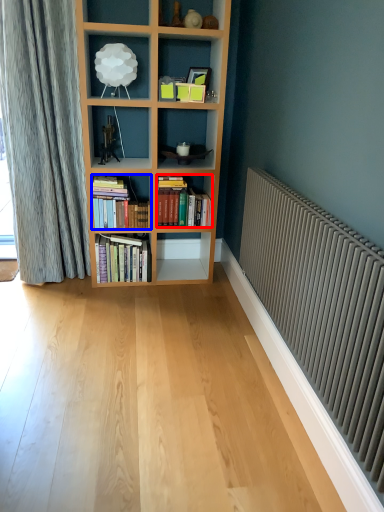
Question: Which object appears closest to the camera in this image, book (highlighted by a red box) or book (highlighted by a blue box)?

Choices:
 (A) book
 (B) book

Answer: (B)